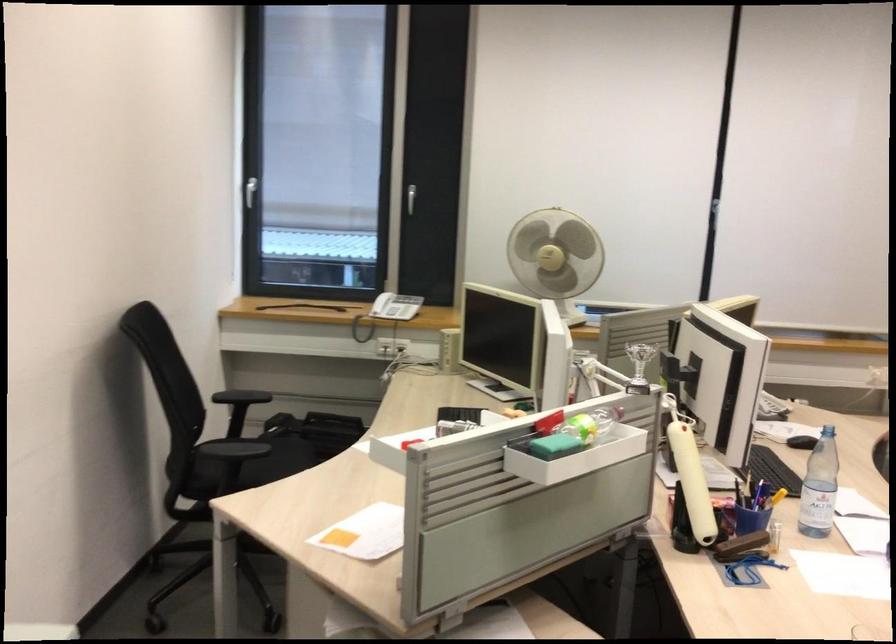
You are a GUI agent. You are given a task and a screenshot of the screen. Output one action in this format:
    pyautogui.click(x=<x>, y=<y>)
    Task: Click on the white cylindrical handle
    
    Given the screenshot: What is the action you would take?
    pyautogui.click(x=690, y=475)